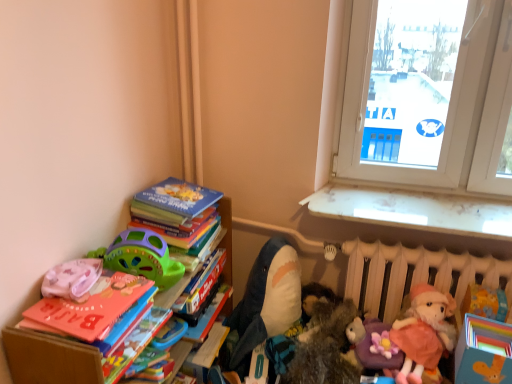
Describe the element at coordinates (485, 302) in the screenshot. The image size is (512, 384). I see `rainbow plastic toy at lower right, which appears as the 6th toy when viewed from the left` at that location.

In order to face hardcover book at lower left, which appears as the 1th book when ordered from the bottom, should I rotate leftwards or rightwards?

A 16.482 degree turn to the left will do.

From the picture: Measure the distance between hardcover book at lower left, which appears as the 1th book when ordered from the bottom, and camera.

They are 37.99 inches apart.

Describe the element at coordinates (141, 257) in the screenshot. This screenshot has width=512, height=384. I see `green plastic toy at left, which appears as the fifth toy when viewed from the right` at that location.

How much space does hardcover books at upper left, placed as the first book when sorted from top to bottom, occupy vertically?

It is 7.62 inches.

You are a GUI agent. You are given a task and a screenshot of the screen. Output one action in this format:
    pyautogui.click(x=<x>, y=<y>)
    Task: Click on the fuzzy brown stuffed animal at center, the 4th toy in the left-to-right sequence
    This screenshot has height=384, width=512.
    Given the screenshot: What is the action you would take?
    pyautogui.click(x=325, y=348)

In the image, is purple plush toy at lower right, acting as the 5th toy starting from the left, positioned in front of or behind hardcover book at center, which is counted as the second book, starting from the bottom?

Result: In the image, purple plush toy at lower right, acting as the 5th toy starting from the left, appears behind hardcover book at center, which is counted as the second book, starting from the bottom.

From the image's perspective, relative to hardcover book at center, the 2th book viewed from the top, is purple plush toy at lower right, acting as the 5th toy starting from the left, above or below?

purple plush toy at lower right, acting as the 5th toy starting from the left, is below hardcover book at center, the 2th book viewed from the top.

Identify the location of the 1st book above the purple plush toy at lower right, acting as the 5th toy starting from the left (from the image's perspective). The width and height of the screenshot is (512, 384). (201, 287).

Looking at this image, is purple plush toy at lower right, the 2th toy viewed from the right, outside of hardcover book at center, the 2th book viewed from the top?

purple plush toy at lower right, the 2th toy viewed from the right, lies outside hardcover book at center, the 2th book viewed from the top,'s area.

Is wooden bookcase at left shorter than rainbow plastic toy at lower right, which appears as the 6th toy when viewed from the left?

In fact, wooden bookcase at left may be taller than rainbow plastic toy at lower right, which appears as the 6th toy when viewed from the left.

Could you tell me if wooden bookcase at left is facing rainbow plastic toy at lower right, which appears as the 6th toy when viewed from the left?

Yes.

In the image, is wooden bookcase at left positioned in front of or behind rainbow plastic toy at lower right, which appears as the 6th toy when viewed from the left?

wooden bookcase at left is in front of rainbow plastic toy at lower right, which appears as the 6th toy when viewed from the left.

Which point is more forward, (x=226, y=210) or (x=483, y=289)?

The point (x=483, y=289) is more forward.

Does soft plush shark at center, which is counted as the 3th toy, starting from the left, have a greater width compared to white plastic window at upper right?

Yes.

Is soft plush shark at center, the 4th toy positioned from the right, taller or shorter than white plastic window at upper right?

Clearly, soft plush shark at center, the 4th toy positioned from the right, is shorter compared to white plastic window at upper right.

Locate an element on the screen. The image size is (512, 384). toy lying behind the white plastic window at upper right is located at coordinates (265, 303).

Is soft plush shark at center, which is counted as the 3th toy, starting from the left, far away from white plastic window at upper right?

soft plush shark at center, which is counted as the 3th toy, starting from the left, is actually quite close to white plastic window at upper right.

Is white glossy window sill at upper right taller or shorter than hardcover book at center, which is counted as the second book, starting from the bottom?

In the image, white glossy window sill at upper right appears to be taller than hardcover book at center, which is counted as the second book, starting from the bottom.

Would you say hardcover book at center, which is counted as the second book, starting from the bottom, is part of white glossy window sill at upper right's contents?

Actually, hardcover book at center, which is counted as the second book, starting from the bottom, is outside white glossy window sill at upper right.

In order to click on window sill above the hardcover book at center, which is counted as the second book, starting from the bottom (from a real-world perspective) in this screenshot , I will do `click(414, 210)`.

Considering the sizes of objects white glossy window sill at upper right and hardcover book at center, the 2th book viewed from the top, in the image provided, who is wider, white glossy window sill at upper right or hardcover book at center, the 2th book viewed from the top,?

With larger width is white glossy window sill at upper right.

Who is shorter, pink fabric pillow at left, which is counted as the 6th toy, starting from the right, or hardcover books at upper left, placed as the first book when sorted from top to bottom?

pink fabric pillow at left, which is counted as the 6th toy, starting from the right, is shorter.

Is pink fabric pillow at left, which is counted as the 6th toy, starting from the right, bigger than hardcover books at upper left, placed as the first book when sorted from top to bottom?

No, pink fabric pillow at left, which is counted as the 6th toy, starting from the right, is not bigger than hardcover books at upper left, placed as the first book when sorted from top to bottom.

Consider the image. Which object is further away from the camera, pink fabric pillow at left, which is the 1th toy in left-to-right order, or hardcover books at upper left, which ranks as the 3th book in bottom-to-top order?

hardcover books at upper left, which ranks as the 3th book in bottom-to-top order, is more distant.

Considering the positions of points (60, 290) and (199, 219), is point (60, 290) closer to camera compared to point (199, 219)?

Yes, it is in front of point (199, 219).

Could you tell me if purple plush toy at lower right, acting as the 5th toy starting from the left, is facing fuzzy brown stuffed animal at center, the 3th toy in the right-to-left sequence?

No, purple plush toy at lower right, acting as the 5th toy starting from the left, is not turned towards fuzzy brown stuffed animal at center, the 3th toy in the right-to-left sequence.

Are purple plush toy at lower right, acting as the 5th toy starting from the left, and fuzzy brown stuffed animal at center, the 3th toy in the right-to-left sequence, located far from each other?

No, purple plush toy at lower right, acting as the 5th toy starting from the left, is not far away from fuzzy brown stuffed animal at center, the 3th toy in the right-to-left sequence.

This screenshot has width=512, height=384. In order to click on the 2nd toy in front of the purple plush toy at lower right, the 2th toy viewed from the right in this screenshot , I will do `click(325, 348)`.

Which object is more forward, purple plush toy at lower right, acting as the 5th toy starting from the left, or fuzzy brown stuffed animal at center, the 3th toy in the right-to-left sequence?

fuzzy brown stuffed animal at center, the 3th toy in the right-to-left sequence, is in front.

From the image's perspective, between wooden bookcase at left and white plastic window at upper right, which one is located above?

white plastic window at upper right appears higher in the image.

Find the location of a particular element. The image size is (512, 384). window lying behind the wooden bookcase at left is located at coordinates (439, 120).

Is wooden bookcase at left aimed at white plastic window at upper right?

No.

Starting from the hardcover book at center, which is counted as the second book, starting from the bottom, which toy is the 1st one behind? Please provide its 2D coordinates.

[(371, 344)]

What are the coordinates of `the 4th toy counting from the right of the wooden bookcase at left` in the screenshot? It's located at (485, 302).

Which object lies nearer to the anchor point soft plush shark at center, which is counted as the 3th toy, starting from the left, pink fabric pillow at left, which is the 1th toy in left-to-right order, or green plastic toy at left, which appears as the fifth toy when viewed from the right?

The object closer to soft plush shark at center, which is counted as the 3th toy, starting from the left, is green plastic toy at left, which appears as the fifth toy when viewed from the right.

When comparing their distances from hardcover book at center, the 2th book viewed from the top, does pink fabric pillow at left, which is the 1th toy in left-to-right order, or white plastic window at upper right seem further?

white plastic window at upper right is positioned further to the anchor hardcover book at center, the 2th book viewed from the top.

Which object lies nearer to the anchor point green plastic toy at left, which is counted as the second toy, starting from the left, white matte radiator at lower right or hardcover book at center, which is counted as the second book, starting from the bottom?

hardcover book at center, which is counted as the second book, starting from the bottom, lies closer to green plastic toy at left, which is counted as the second toy, starting from the left, than the other object.

Considering their positions, is rainbow plastic toy at lower right, which appears as the 6th toy when viewed from the left, positioned further to white matte radiator at lower right than pink fabric pillow at left, which is counted as the 6th toy, starting from the right?

Among the two, pink fabric pillow at left, which is counted as the 6th toy, starting from the right, is located further to white matte radiator at lower right.

Which object lies further to the anchor point hardcover books at upper left, which ranks as the 3th book in bottom-to-top order, white plastic window at upper right or hardcover book at center, the 2th book viewed from the top?

white plastic window at upper right lies further to hardcover books at upper left, which ranks as the 3th book in bottom-to-top order, than the other object.

When comparing their distances from white plastic window at upper right, does hardcover book at lower left, the third book from the top, or pink fabric pillow at left, which is counted as the 6th toy, starting from the right, seem closer?

Among the two, hardcover book at lower left, the third book from the top, is located nearer to white plastic window at upper right.

Considering their positions, is white matte radiator at lower right positioned further to soft plush shark at center, the 4th toy positioned from the right, than white plastic window at upper right?

The object further to soft plush shark at center, the 4th toy positioned from the right, is white plastic window at upper right.

When comparing their distances from pink fabric pillow at left, which is counted as the 6th toy, starting from the right, does purple plush toy at lower right, the 2th toy viewed from the right, or soft plush shark at center, which is counted as the 3th toy, starting from the left, seem closer?

Among the two, soft plush shark at center, which is counted as the 3th toy, starting from the left, is located nearer to pink fabric pillow at left, which is counted as the 6th toy, starting from the right.

Image resolution: width=512 pixels, height=384 pixels. Identify the location of bookcase between pink fabric pillow at left, which is the 1th toy in left-to-right order, and white glossy window sill at upper right, in the horizontal direction. (49, 358).

The height and width of the screenshot is (384, 512). What are the coordinates of `bookcase between green plastic toy at left, which is counted as the second toy, starting from the left, and white matte radiator at lower right, in the horizontal direction` in the screenshot? It's located at (49, 358).

Where is `bookcase between pink fabric pillow at left, which is the 1th toy in left-to-right order, and white matte radiator at lower right, in the horizontal direction`? The image size is (512, 384). bookcase between pink fabric pillow at left, which is the 1th toy in left-to-right order, and white matte radiator at lower right, in the horizontal direction is located at coordinates (49, 358).

Identify the location of bookcase between hardcover book at lower left, the third book from the top, and white matte radiator at lower right. (49, 358).